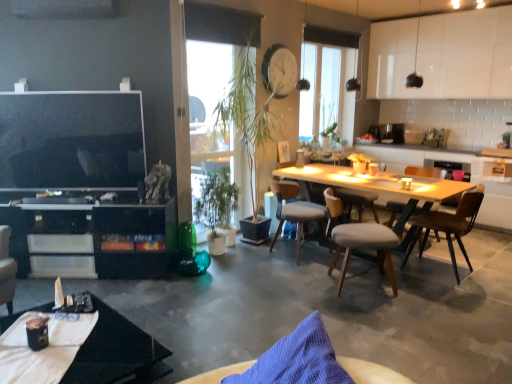
Question: Does black glass coffee table at lower left turn towards transparent glass window at center?

Choices:
 (A) yes
 (B) no

Answer: (B)

Question: Is black glass coffee table at lower left located outside transparent glass window at center?

Choices:
 (A) yes
 (B) no

Answer: (A)

Question: Is black glass coffee table at lower left looking in the opposite direction of transparent glass window at center?

Choices:
 (A) no
 (B) yes

Answer: (A)

Question: Does black glass coffee table at lower left have a lesser height compared to transparent glass window at center?

Choices:
 (A) yes
 (B) no

Answer: (A)

Question: From a real-world perspective, does black glass coffee table at lower left sit lower than transparent glass window at center?

Choices:
 (A) no
 (B) yes

Answer: (B)

Question: Is light gray fabric chair at center, which is the first chair in back-to-front order, in front of or behind transparent glass window at center in the image?

Choices:
 (A) front
 (B) behind

Answer: (A)

Question: In terms of size, does light gray fabric chair at center, acting as the 2th chair starting from the left, appear bigger or smaller than transparent glass window at center?

Choices:
 (A) big
 (B) small

Answer: (A)

Question: Does point (282, 208) appear closer or farther from the camera than point (332, 140)?

Choices:
 (A) closer
 (B) farther

Answer: (A)

Question: From a real-world perspective, is light gray fabric chair at center, acting as the 2th chair starting from the left, above or below transparent glass window at center?

Choices:
 (A) above
 (B) below

Answer: (B)

Question: Based on their positions, is beige fabric chair at center, the second chair viewed from the right, located to the left or right of green matte plant at center?

Choices:
 (A) right
 (B) left

Answer: (A)

Question: Looking at the image, does beige fabric chair at center, the 3th chair viewed from the left, seem bigger or smaller compared to green matte plant at center?

Choices:
 (A) big
 (B) small

Answer: (A)

Question: From a real-world perspective, relative to green matte plant at center, is beige fabric chair at center, the 3th chair viewed from the left, vertically above or below?

Choices:
 (A) above
 (B) below

Answer: (B)

Question: Is beige fabric chair at center, arranged as the third chair when viewed from the back, inside or outside of green matte plant at center?

Choices:
 (A) inside
 (B) outside

Answer: (B)

Question: From the image's perspective, is brown wooden chair at center, the fourth chair viewed from the left, positioned above or below black glossy cabinet at lower left?

Choices:
 (A) above
 (B) below

Answer: (A)

Question: Does point pyautogui.click(x=436, y=215) appear closer or farther from the camera than point pyautogui.click(x=84, y=231)?

Choices:
 (A) farther
 (B) closer

Answer: (A)